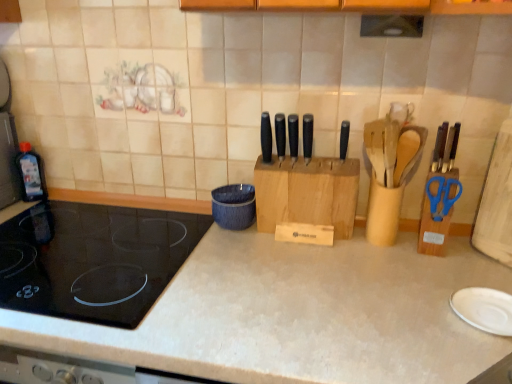
I want to click on free location to the right of black matte knife at center, which is the third knife from right to left, so click(x=332, y=158).